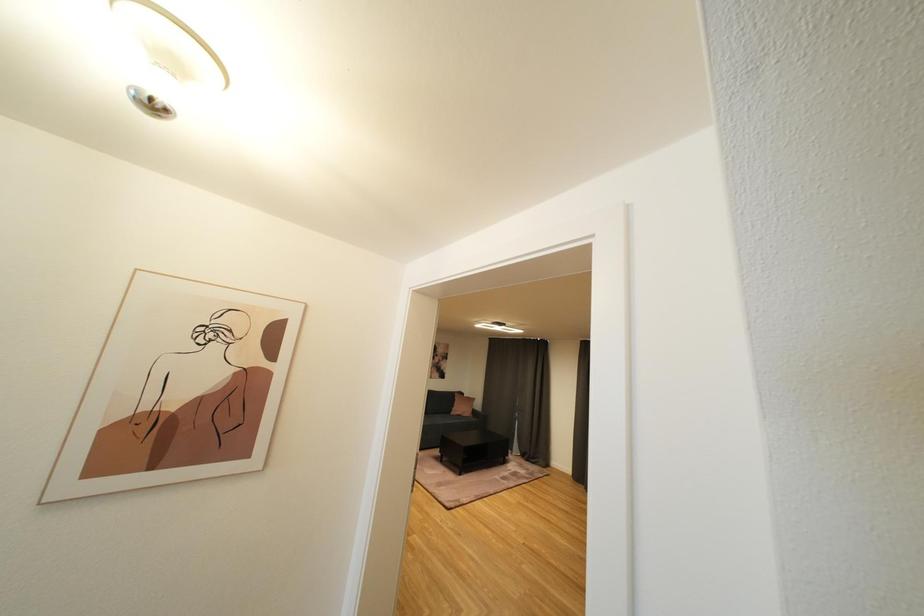
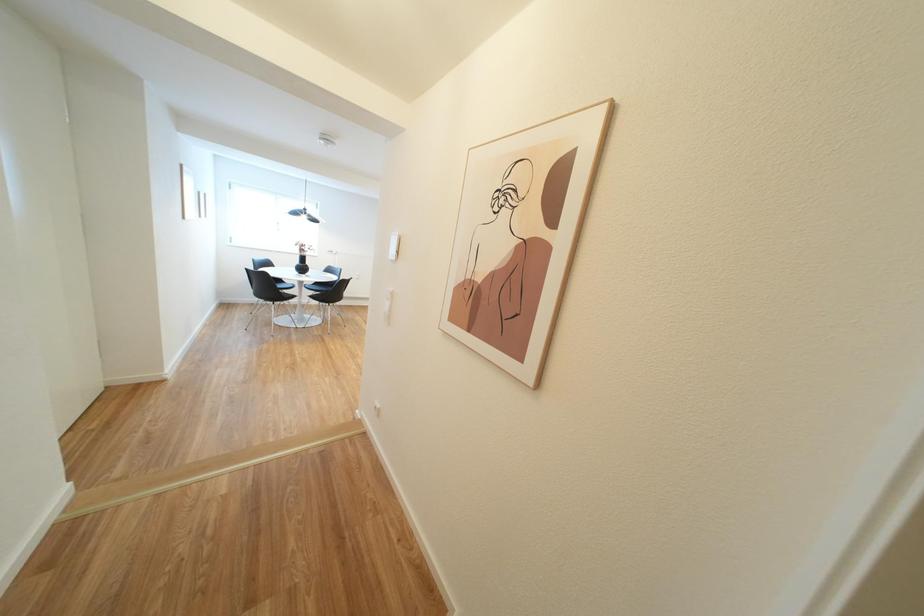
Question: The camera is either moving clockwise (left) or counter-clockwise (right) around the object. The first image is from the beginning of the video and the second image is from the end. Is the camera moving left or right when shooting the video?

Choices:
 (A) Left
 (B) Right

Answer: (B)